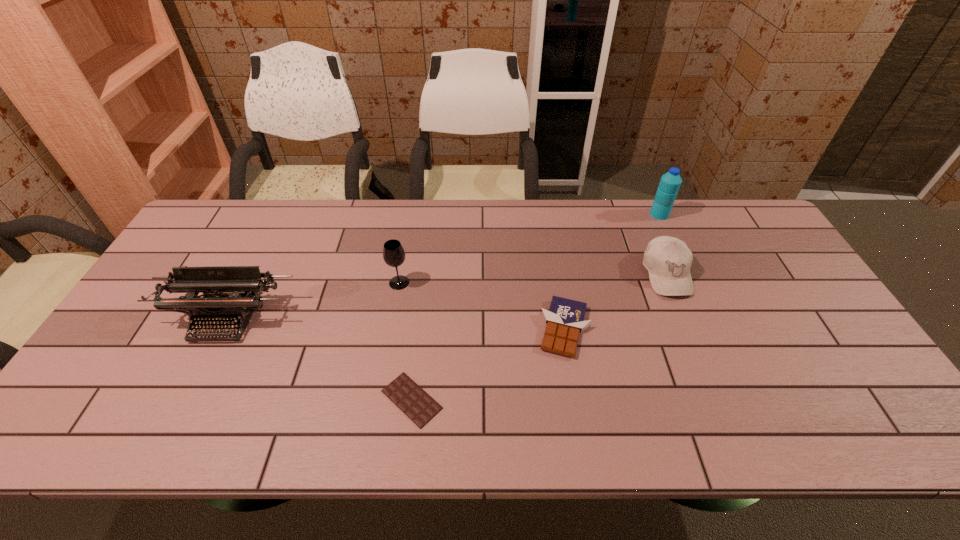
What are the coordinates of `the farthest object` in the screenshot? It's located at (670, 182).

This screenshot has height=540, width=960. Identify the location of water bottle. (x=670, y=182).

Where is `wineglass`? This screenshot has width=960, height=540. wineglass is located at coordinates (393, 253).

Image resolution: width=960 pixels, height=540 pixels. In order to click on the leftmost object in this screenshot , I will do `click(243, 283)`.

Identify the location of baseball cap. (668, 260).

Locate an element on the screen. the farther chocolate bar is located at coordinates pos(565,320).

Where is `the right chocolate bar`? This screenshot has height=540, width=960. the right chocolate bar is located at coordinates (565, 320).

What are the coordinates of `the shorter chocolate bar` in the screenshot? It's located at (408, 396).

Where is `the shortest object`? The height and width of the screenshot is (540, 960). the shortest object is located at coordinates (408, 396).

You are a GUI agent. You are given a task and a screenshot of the screen. Output one action in this format:
    pyautogui.click(x=<x>, y=<y>)
    Task: Click on the vacant space situated on the right of the tallest object
    This screenshot has height=540, width=960.
    Given the screenshot: What is the action you would take?
    pyautogui.click(x=715, y=214)